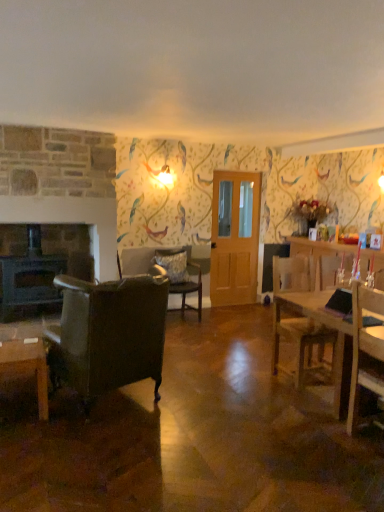
Question: In terms of width, does dark gray stone fireplace at left look wider or thinner when compared to fluffy gray pillow at center?

Choices:
 (A) thin
 (B) wide

Answer: (B)

Question: From the image's perspective, is dark gray stone fireplace at left located above or below fluffy gray pillow at center?

Choices:
 (A) above
 (B) below

Answer: (B)

Question: Which is farther from the dark gray stone fireplace at left?

Choices:
 (A) wooden table at right
 (B) fluffy gray pillow at center
 (C) wooden coffee table at lower left
 (D) green leafy plant at right
 (E) clear glass door at center

Answer: (A)

Question: Estimate the real-world distances between objects in this image. Which object is farther from the fluffy gray pillow at center?

Choices:
 (A) wooden coffee table at lower left
 (B) wooden chair at right, positioned as the first chair in right-to-left order
 (C) wooden table at right
 (D) dark gray stone fireplace at left
 (E) clear glass door at center

Answer: (A)